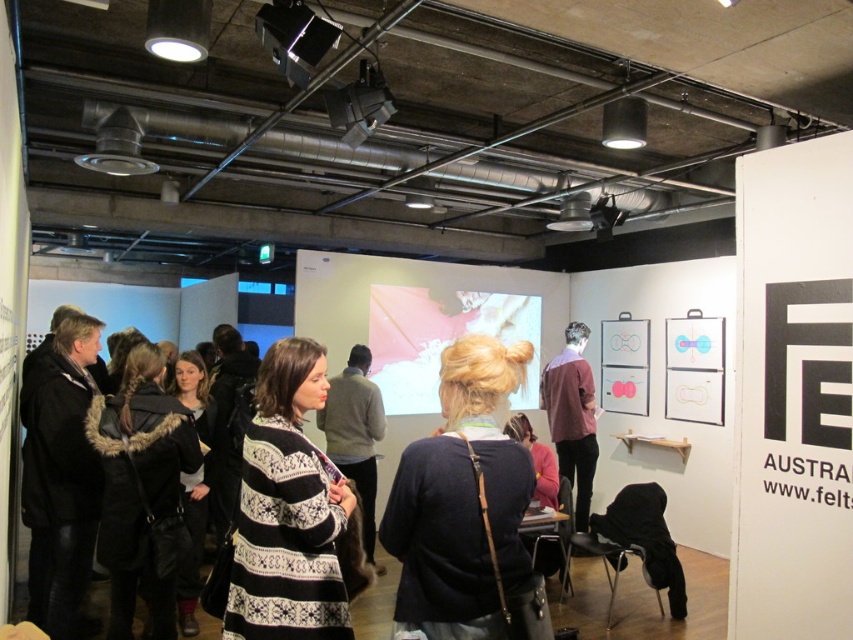
Can you confirm if matte white projection screen at center is bigger than black plastic projector at upper center?

Yes.

Is point (560, 324) positioned after point (276, 35)?

Yes, it is behind point (276, 35).

Which is behind, point (465, 292) or point (300, 16)?

Positioned behind is point (465, 292).

Locate an element on the screen. The width and height of the screenshot is (853, 640). matte white projection screen at center is located at coordinates (422, 316).

Is dark blue sweater at center below maroon sweater at center?

Actually, dark blue sweater at center is above maroon sweater at center.

What do you see at coordinates (466, 509) in the screenshot? The height and width of the screenshot is (640, 853). I see `dark blue sweater at center` at bounding box center [466, 509].

This screenshot has width=853, height=640. I want to click on dark blue sweater at center, so click(x=466, y=509).

How far apart are striped sweater at center and black plastic projector at upper center?

striped sweater at center and black plastic projector at upper center are 8.09 feet apart from each other.

Can you confirm if striped sweater at center is positioned to the right of black plastic projector at upper center?

Yes, striped sweater at center is to the right of black plastic projector at upper center.

Does point (344, 426) come in front of point (291, 60)?

No, (344, 426) is behind (291, 60).

Find the location of a particular element. Image resolution: width=853 pixels, height=640 pixels. striped sweater at center is located at coordinates click(x=355, y=435).